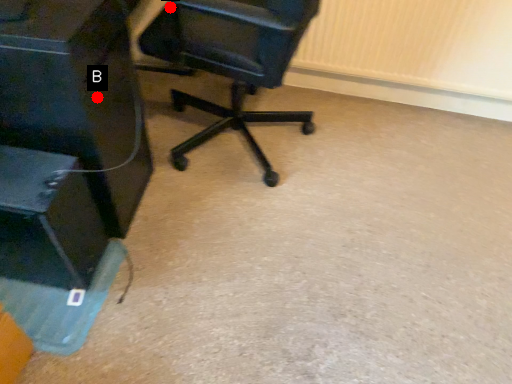
Question: Two points are circled on the image, labeled by A and B beside each circle. Which of the following is the closest to the observer?

Choices:
 (A) A is closer
 (B) B is closer

Answer: (B)